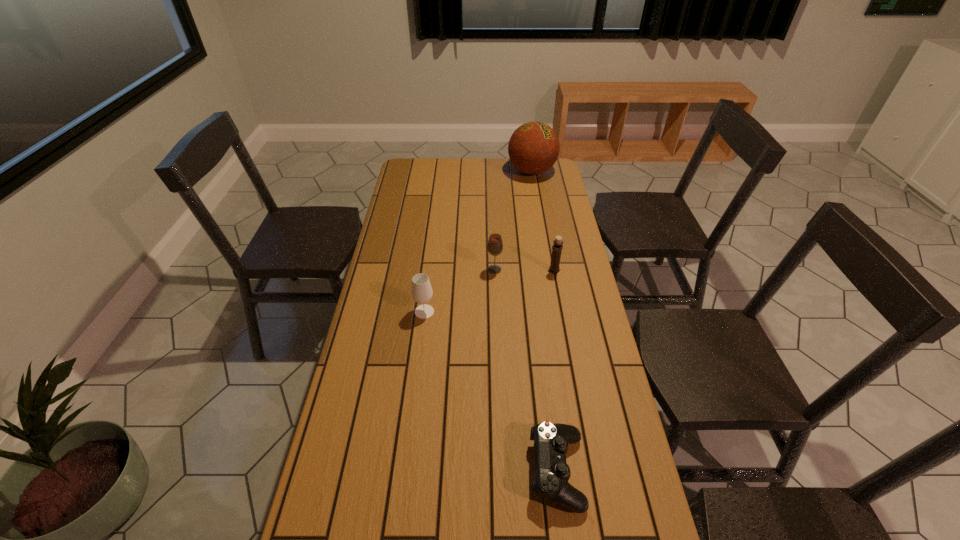
Locate an element on the screen. The image size is (960, 540). basketball is located at coordinates (533, 148).

Locate an element on the screen. This screenshot has height=540, width=960. the tallest object is located at coordinates (533, 148).

Locate an element on the screen. The image size is (960, 540). candle holder is located at coordinates (557, 248).

Identify the location of the right glass. This screenshot has height=540, width=960. (495, 245).

The image size is (960, 540). Find the location of `the second object from left to right`. the second object from left to right is located at coordinates (495, 245).

This screenshot has width=960, height=540. In order to click on the left glass in this screenshot , I will do `click(421, 292)`.

Locate an element on the screen. The image size is (960, 540). the nearer glass is located at coordinates (421, 292).

Locate an element on the screen. This screenshot has width=960, height=540. the shortest object is located at coordinates (552, 473).

This screenshot has height=540, width=960. I want to click on control, so click(552, 473).

Where is `free space located 0.120m on the front of the basketball`? This screenshot has height=540, width=960. free space located 0.120m on the front of the basketball is located at coordinates (537, 199).